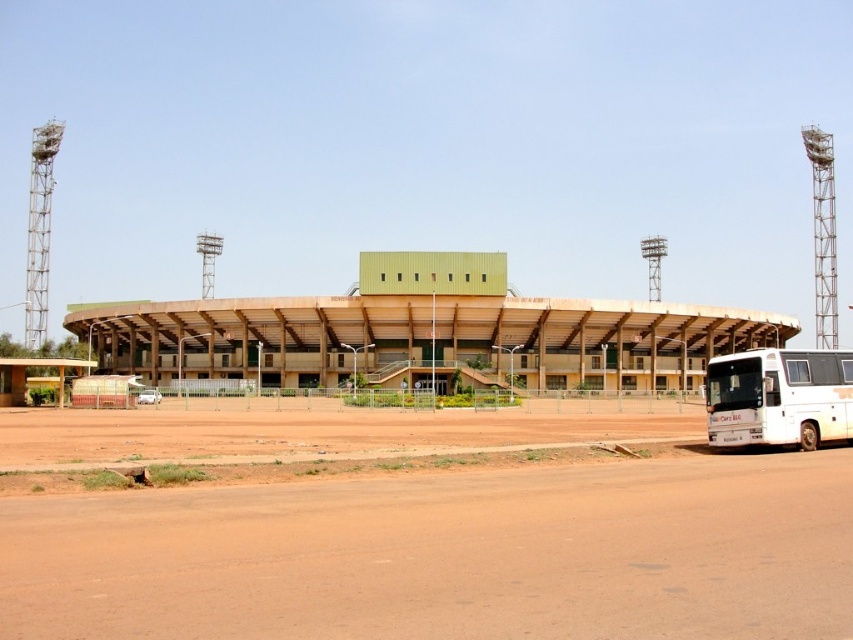
You are standing at the entrance of the green matte stadium at center and want to reach the white matte bus at lower right. Based on the scene, in which direction should you walk to find the bus?

The green matte stadium at center is located above the white matte bus at lower right, so you should walk downward or towards the lower right direction to reach the bus.